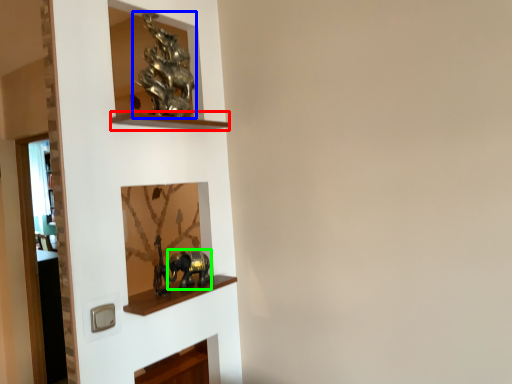
Question: Based on their relative distances, which object is farther from cabinet (highlighted by a red box)? Choose from art (highlighted by a blue box) and art (highlighted by a green box).

Choices:
 (A) art
 (B) art

Answer: (B)